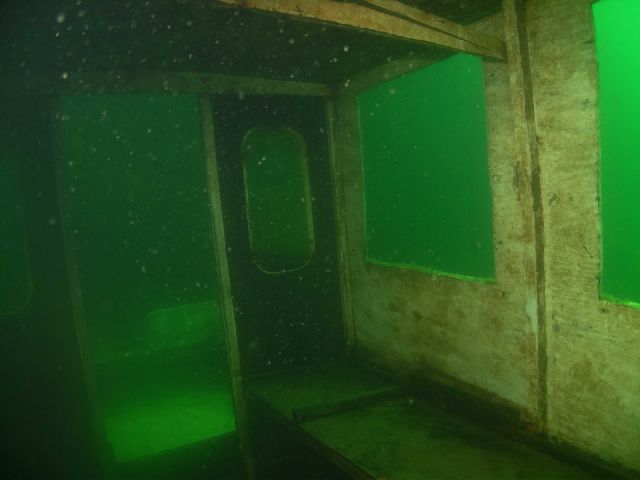
Where is `doors`? doors is located at coordinates (253, 339), (45, 392).